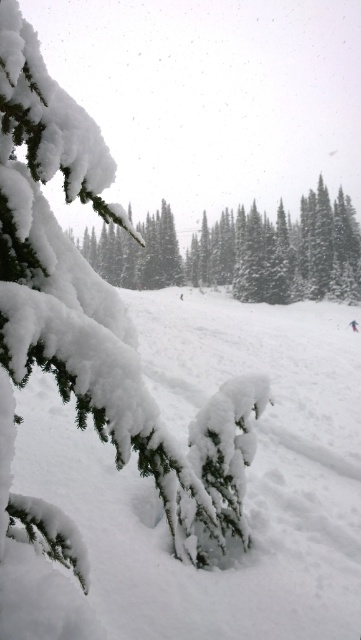
You are standing at the point marked by the coordinates point (242, 252). Looking around, you see a snow scene with a snow covered pine branch at center. What is the object located at your current position?

The object located at point (242, 252) is the snow covered pine branch at center.